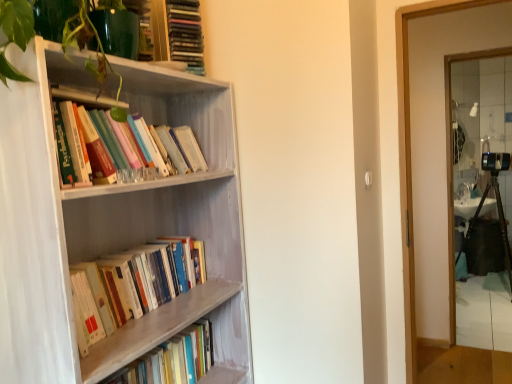
Question: From the image's perspective, is clear glass mirror at right located above or below matte plastic books at upper center, the 1th book viewed from the top?

Choices:
 (A) below
 (B) above

Answer: (A)

Question: Based on their sizes in the image, would you say clear glass mirror at right is bigger or smaller than matte plastic books at upper center, the 1th book viewed from the top?

Choices:
 (A) big
 (B) small

Answer: (A)

Question: Which is farther from the wooden bookshelf at left, marked as the 3th book in a top-to-bottom arrangement?

Choices:
 (A) wooden book at left, the 4th book viewed from the top
 (B) hardcover books at upper left, which is the 3th book in bottom-to-top order
 (C) matte plastic books at upper center, acting as the 4th book starting from the bottom
 (D) clear glass mirror at right
 (E) green glossy plant at upper left

Answer: (D)

Question: Which object is the closest to the wooden book at left, the 4th book viewed from the top?

Choices:
 (A) green glossy plant at upper left
 (B) clear glass mirror at right
 (C) wooden bookcase at left
 (D) wooden bookshelf at left, marked as the 3th book in a top-to-bottom arrangement
 (E) hardcover books at upper left, which is the 3th book in bottom-to-top order

Answer: (D)